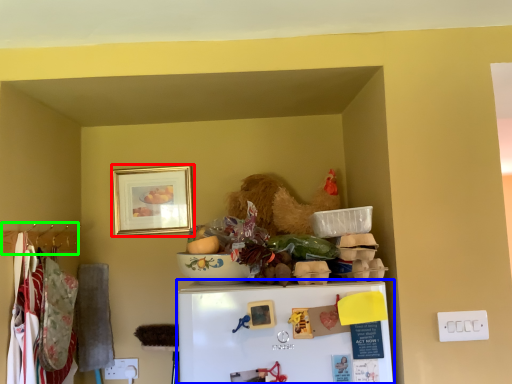
Question: Which object is positioned closest to picture frame (highlighted by a red box)? Select from refrigerator (highlighted by a blue box) and hanger (highlighted by a green box).

Choices:
 (A) refrigerator
 (B) hanger

Answer: (B)